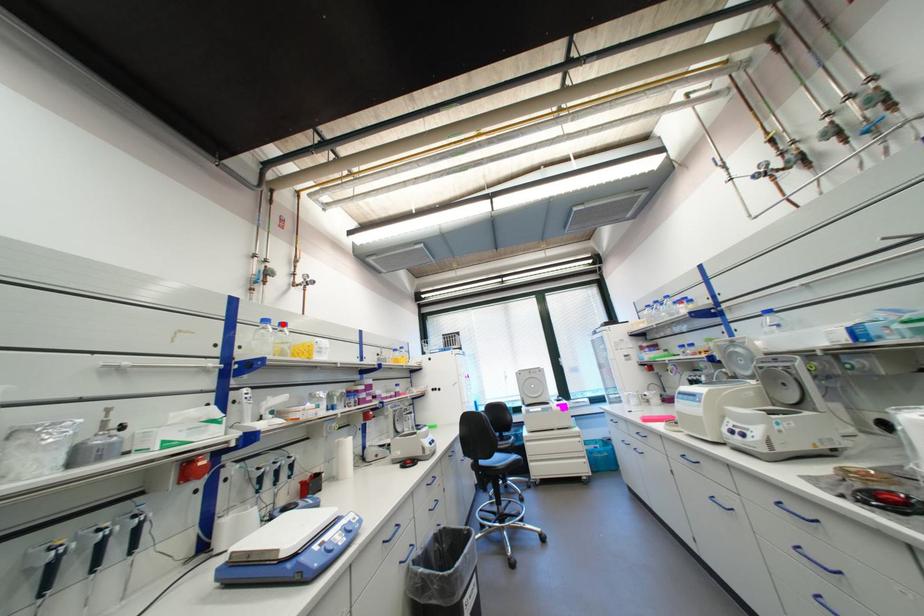
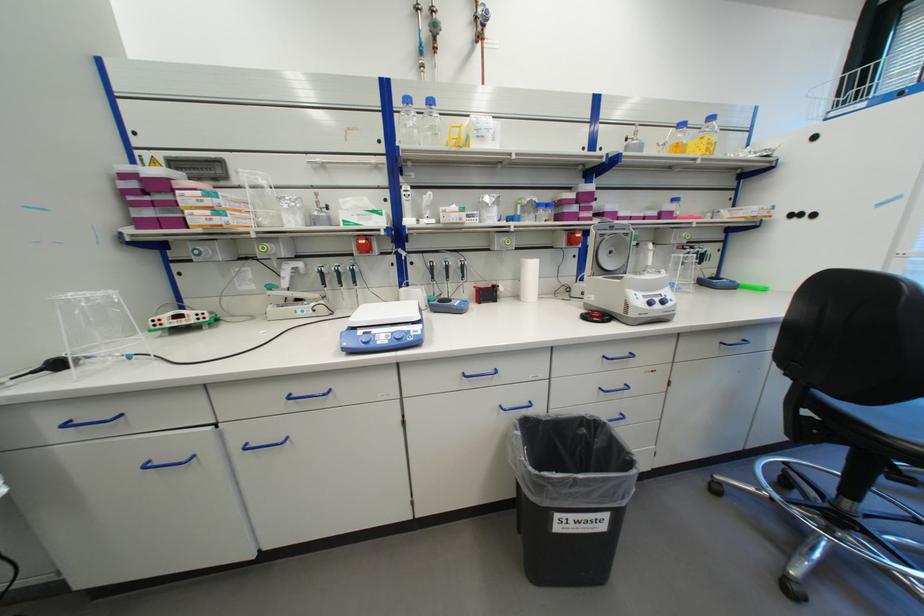
The point at the highlighted location is marked in the first image. Where is the corresponding point in the second image?

(428, 103)